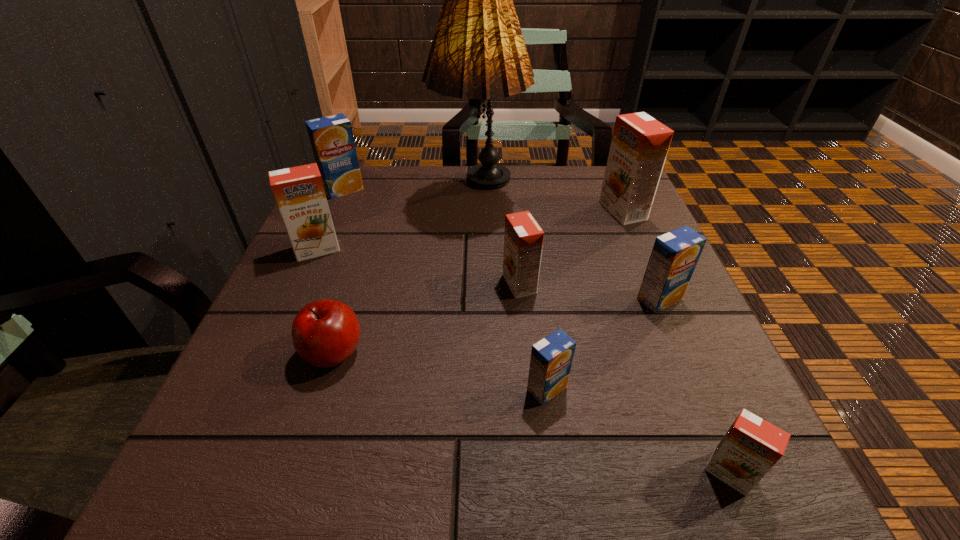
At what (x,y) coordinates should I click in order to perform the action: click on free space that satisfies the following two spatial constraints: 1. on the front-facing side of the third farthest orange orange juice; 2. on the right side of the lampshade. Please return your answer as a coordinate pair (x, y). Looking at the image, I should click on (478, 284).

In order to click on vacant region that satisfies the following two spatial constraints: 1. on the back side of the nearest orange orange juice; 2. on the left side of the farthest orange orange juice in this screenshot , I will do `click(619, 211)`.